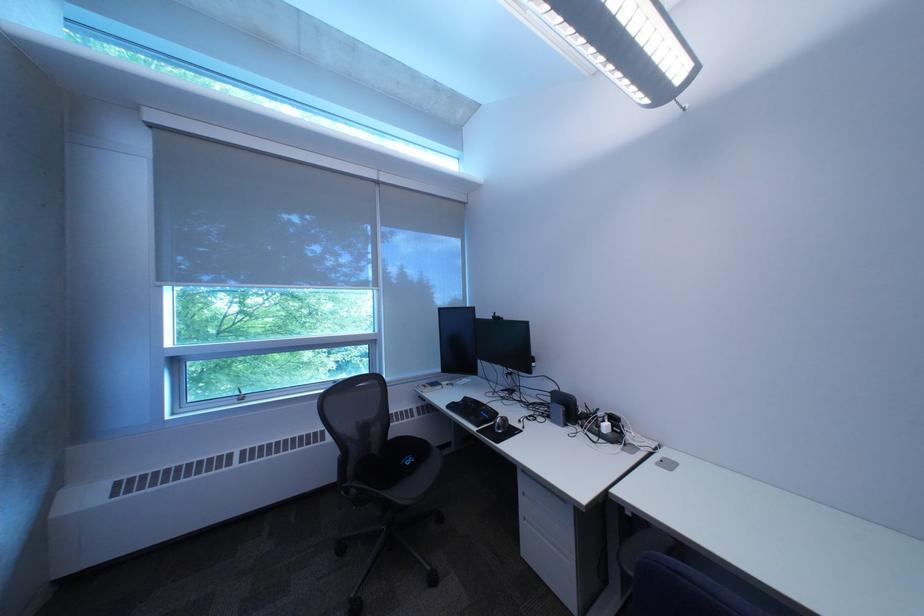
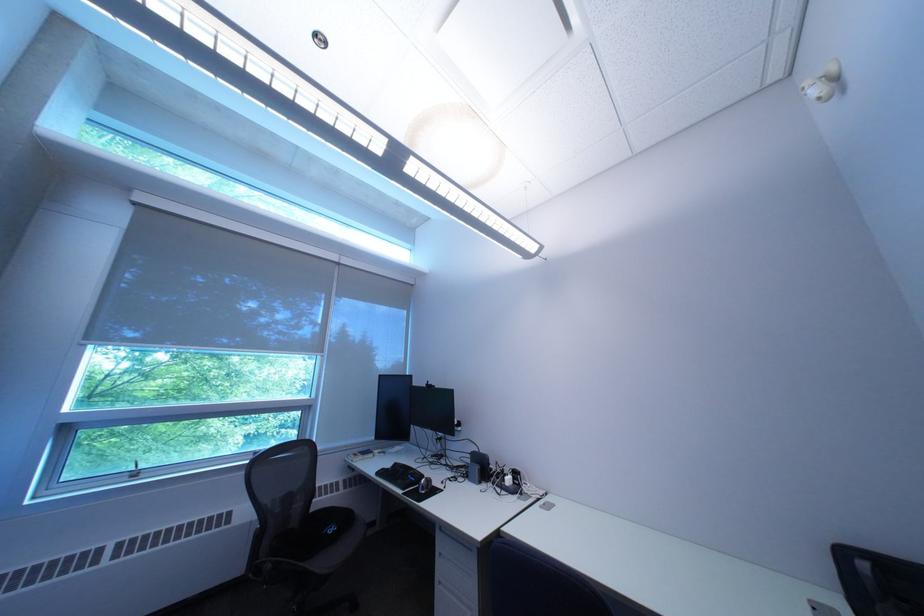
Locate, in the second image, the point that corresponds to point (492, 432) in the first image.

(418, 495)